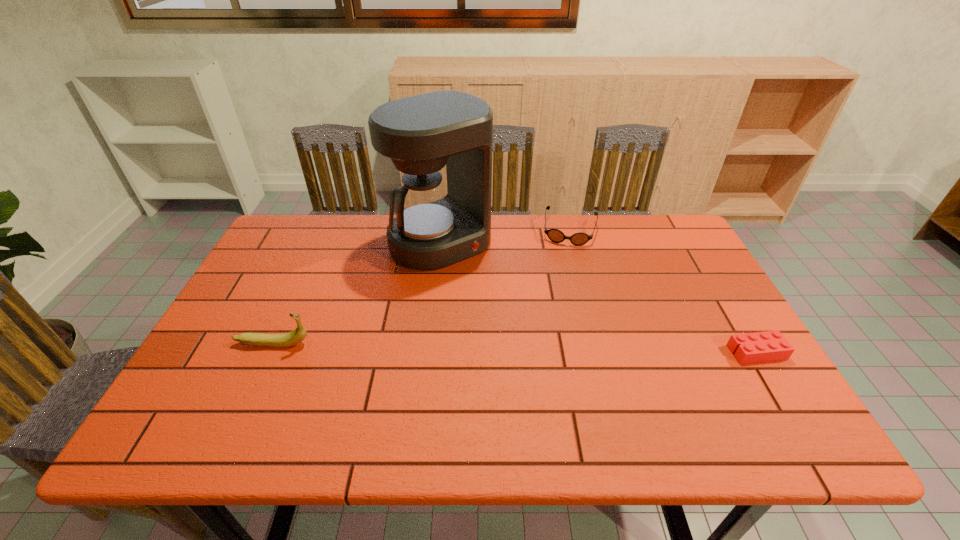
Locate an element on the screen. This screenshot has width=960, height=540. vacant space situated 0.250m on the front-facing side of the third object from right to left is located at coordinates (517, 319).

I want to click on vacant space located 0.180m on the front-facing side of the third object from right to left, so click(x=502, y=303).

You are a GUI agent. You are given a task and a screenshot of the screen. Output one action in this format:
    pyautogui.click(x=<x>, y=<y>)
    Task: Click on the vacant region located 0.050m on the front-facing side of the third object from right to left
    The height and width of the screenshot is (540, 960).
    Given the screenshot: What is the action you would take?
    pyautogui.click(x=476, y=276)

Identify the location of blank space located on the lenses of the third tallest object. (557, 314).

You are a GUI agent. You are given a task and a screenshot of the screen. Output one action in this format:
    pyautogui.click(x=<x>, y=<y>)
    Task: Click on the vacant area situated on the lenses of the third tallest object
    The width and height of the screenshot is (960, 540).
    Given the screenshot: What is the action you would take?
    pyautogui.click(x=564, y=260)

At what (x,y) coordinates should I click in order to perform the action: click on vacant space located 0.240m on the lenses of the third tallest object. Please return your answer as a coordinate pair (x, y). The width and height of the screenshot is (960, 540). Looking at the image, I should click on (560, 298).

Find the location of `coffee maker that is at the far edge`. coffee maker that is at the far edge is located at coordinates (436, 225).

Where is `sunglasses that is at the far edge`? The width and height of the screenshot is (960, 540). sunglasses that is at the far edge is located at coordinates (555, 235).

The height and width of the screenshot is (540, 960). In order to click on object located in the left edge section of the desktop in this screenshot , I will do `click(298, 335)`.

The image size is (960, 540). In order to click on object at the right edge in this screenshot , I will do `click(769, 346)`.